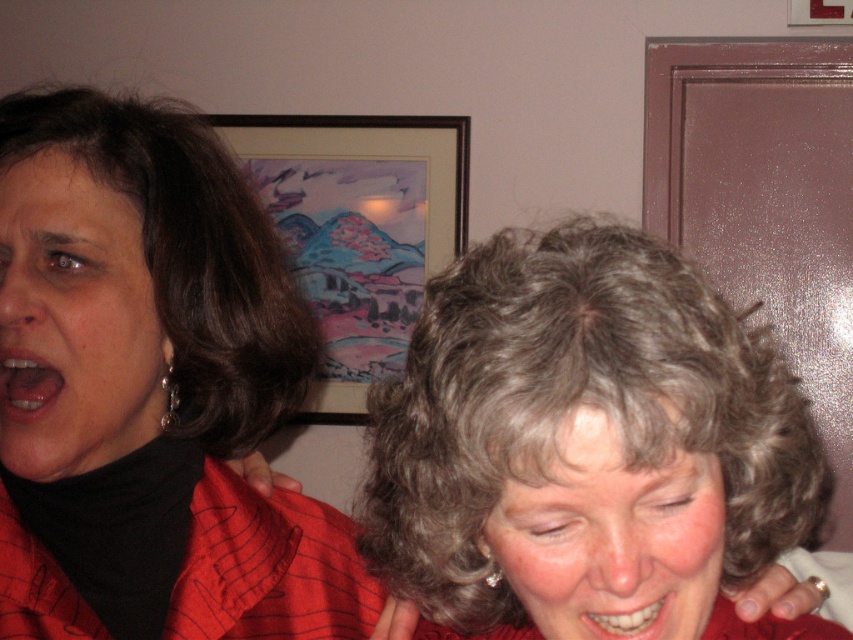
Is wooden framed artwork at upper center wider than smooth skin face at center?

Yes, wooden framed artwork at upper center is wider than smooth skin face at center.

Between wooden framed artwork at upper center and smooth skin face at center, which one appears on the right side from the viewer's perspective?

Positioned to the right is smooth skin face at center.

The width and height of the screenshot is (853, 640). What do you see at coordinates (358, 227) in the screenshot? I see `wooden framed artwork at upper center` at bounding box center [358, 227].

Locate an element on the screen. The width and height of the screenshot is (853, 640). wooden framed artwork at upper center is located at coordinates (358, 227).

Who is more distant from viewer, (193,122) or (97,330)?

The point (193,122) is behind.

Can you confirm if matte black shirt at left is positioned below matte black face at left?

Yes.

Measure the distance between matte black shirt at left and camera.

matte black shirt at left is 23.40 inches from camera.

I want to click on matte black shirt at left, so click(134, 294).

Does gray curly hair at center appear on the right side of matte black face at left?

Correct, you'll find gray curly hair at center to the right of matte black face at left.

This screenshot has width=853, height=640. What do you see at coordinates (573, 412) in the screenshot?
I see `gray curly hair at center` at bounding box center [573, 412].

Identify the location of gray curly hair at center. Image resolution: width=853 pixels, height=640 pixels. (573, 412).